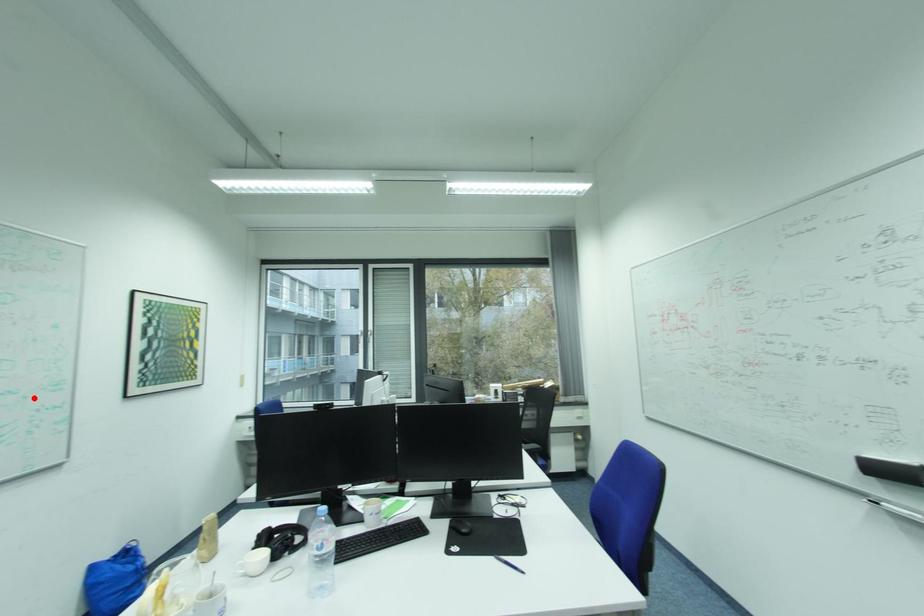
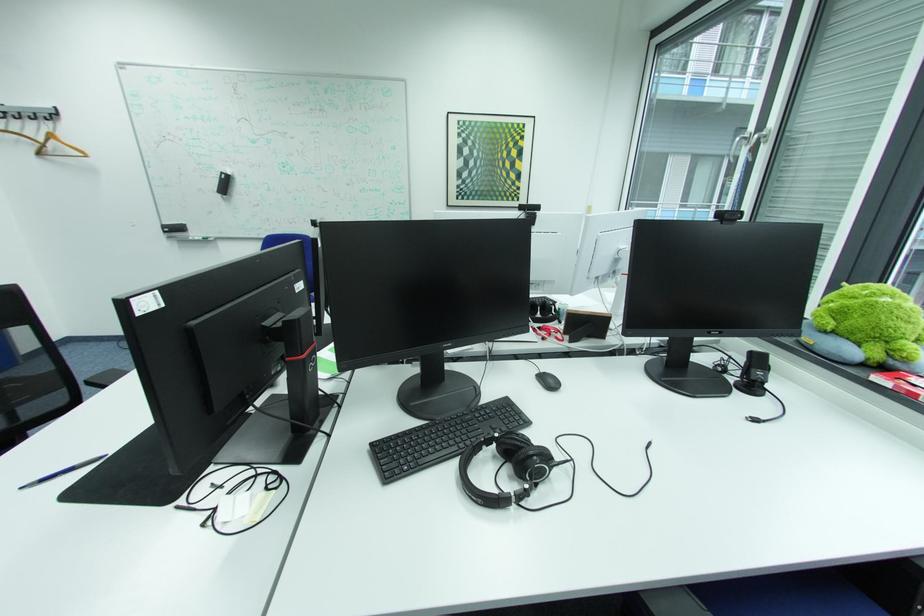
The point at the highlighted location is marked in the first image. Where is the corresponding point in the second image?

(393, 195)